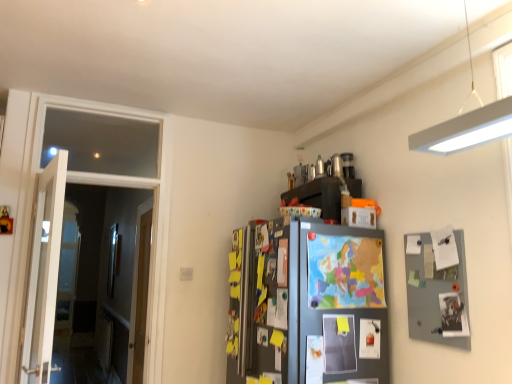
Question: From a real-world perspective, is matte black cabinet at upper right on wooden door at left, which is counted as the 1th door, starting from the back?

Choices:
 (A) no
 (B) yes

Answer: (B)

Question: From the image's perspective, is matte black cabinet at upper right under wooden door at left, which ranks as the second door in front-to-back order?

Choices:
 (A) yes
 (B) no

Answer: (B)

Question: Is the position of matte black cabinet at upper right more distant than that of wooden door at left, which ranks as the second door in front-to-back order?

Choices:
 (A) no
 (B) yes

Answer: (A)

Question: Is matte black cabinet at upper right directly adjacent to wooden door at left, which is counted as the 1th door, starting from the back?

Choices:
 (A) yes
 (B) no

Answer: (B)

Question: Is matte black cabinet at upper right to the left of wooden door at left, which ranks as the second door in front-to-back order, from the viewer's perspective?

Choices:
 (A) yes
 (B) no

Answer: (B)

Question: Relative to matte black cabinet at upper right, is white wooden door at left, positioned as the second door in back-to-front order, in front or behind?

Choices:
 (A) front
 (B) behind

Answer: (A)

Question: In terms of height, does white wooden door at left, positioned as the second door in back-to-front order, look taller or shorter compared to matte black cabinet at upper right?

Choices:
 (A) short
 (B) tall

Answer: (B)

Question: From the image's perspective, is white wooden door at left, positioned as the second door in back-to-front order, located above or below matte black cabinet at upper right?

Choices:
 (A) below
 (B) above

Answer: (A)

Question: From a real-world perspective, is white wooden door at left, positioned as the second door in back-to-front order, physically located above or below matte black cabinet at upper right?

Choices:
 (A) above
 (B) below

Answer: (B)

Question: From the image's perspective, is wooden door at left, which is counted as the 1th door, starting from the back, above or below colorful paper map at center?

Choices:
 (A) below
 (B) above

Answer: (A)

Question: Visually, is wooden door at left, which is counted as the 1th door, starting from the back, positioned to the left or to the right of colorful paper map at center?

Choices:
 (A) left
 (B) right

Answer: (A)

Question: Does point (137, 344) appear closer or farther from the camera than point (333, 240)?

Choices:
 (A) farther
 (B) closer

Answer: (A)

Question: Is wooden door at left, which ranks as the second door in front-to-back order, in front of or behind colorful paper map at center in the image?

Choices:
 (A) behind
 (B) front

Answer: (A)

Question: From the image's perspective, is colorful paper map at center above or below matte black cabinet at upper right?

Choices:
 (A) below
 (B) above

Answer: (A)

Question: Choose the correct answer: Is colorful paper map at center inside matte black cabinet at upper right or outside it?

Choices:
 (A) inside
 (B) outside

Answer: (B)